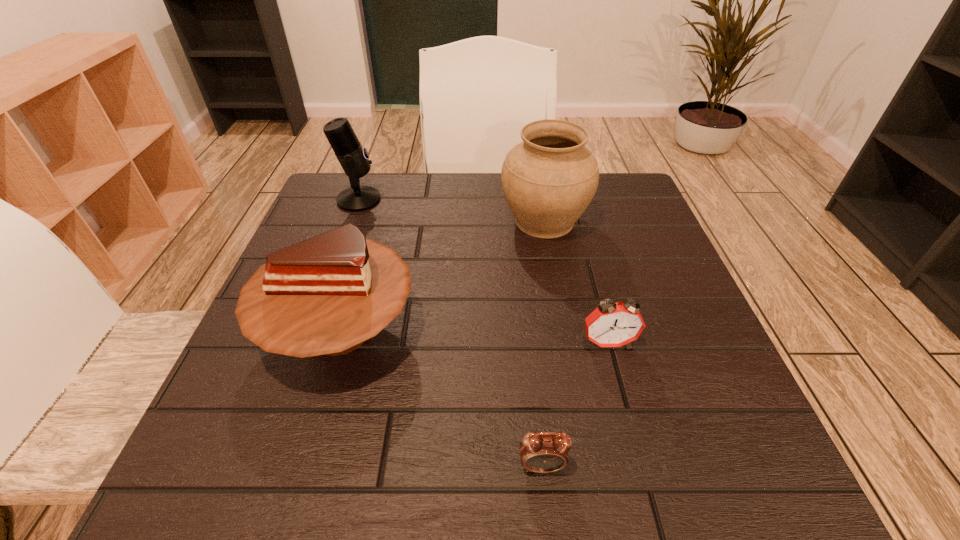
Find the location of a particular element. This screenshot has width=960, height=540. vacant space located 0.200m on the clock face of the right alarm clock is located at coordinates (641, 469).

Where is `urn that is at the far edge`? The width and height of the screenshot is (960, 540). urn that is at the far edge is located at coordinates (549, 179).

Locate an element on the screen. microphone present at the far edge is located at coordinates (353, 158).

At what (x,y) coordinates should I click in order to perform the action: click on object that is positioned at the near edge. Please return your answer as a coordinate pair (x, y). Looking at the image, I should click on pos(545,452).

Where is `microphone that is at the left edge`? microphone that is at the left edge is located at coordinates (353, 158).

The width and height of the screenshot is (960, 540). I want to click on cake that is positioned at the left edge, so click(326, 295).

Where is `urn present at the right edge`? urn present at the right edge is located at coordinates (549, 179).

You are a GUI agent. You are given a task and a screenshot of the screen. Output one action in this format:
    pyautogui.click(x=<x>, y=<y>)
    Task: Click on the alarm clock that is at the right edge
    
    Given the screenshot: What is the action you would take?
    pyautogui.click(x=611, y=324)

The image size is (960, 540). In order to click on object at the far left corner in this screenshot , I will do `click(353, 158)`.

At what (x,y) coordinates should I click in order to perform the action: click on object that is at the far right corner. Please return your answer as a coordinate pair (x, y). Looking at the image, I should click on (549, 179).